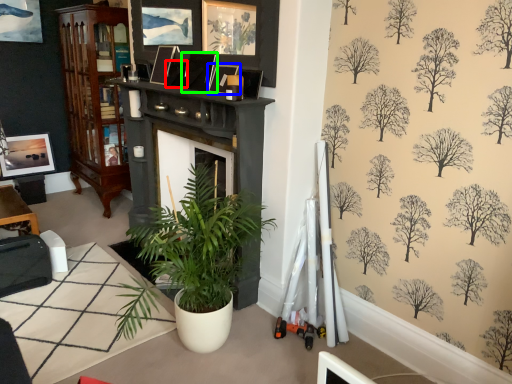
Question: Which object is the farthest from picture frame (highlighted by a red box)? Choose among these: picture frame (highlighted by a blue box) or picture frame (highlighted by a green box).

Choices:
 (A) picture frame
 (B) picture frame

Answer: (A)